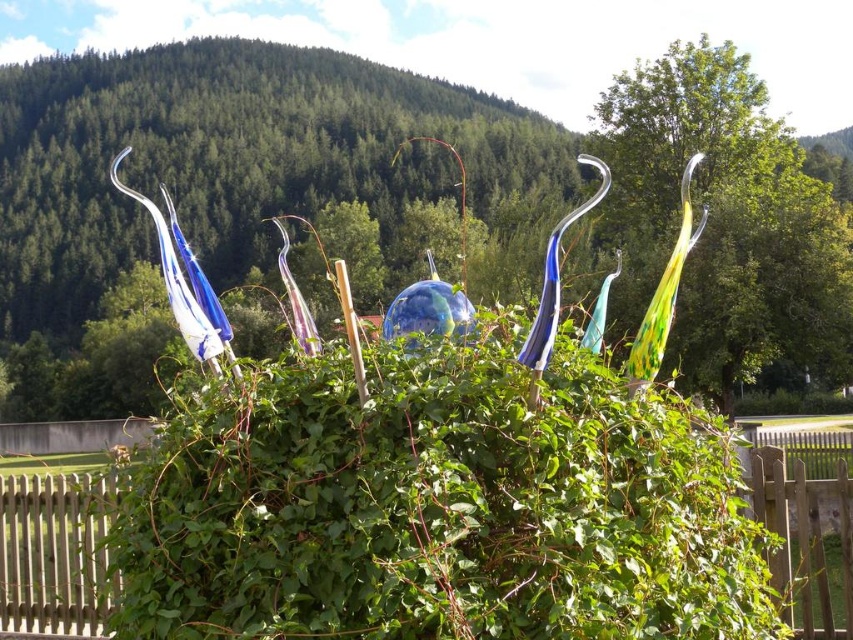
Is green leafy bush at center to the left of wooden fence at lower right from the viewer's perspective?

Indeed, green leafy bush at center is positioned on the left side of wooden fence at lower right.

Where is `green leafy bush at center`? green leafy bush at center is located at coordinates (437, 508).

Locate an element on the screen. The height and width of the screenshot is (640, 853). green leafy bush at center is located at coordinates (437, 508).

Who is taller, green leafy bush at center or white wooden fence at lower left?

white wooden fence at lower left is taller.

How distant is green leafy bush at center from white wooden fence at lower left?

green leafy bush at center and white wooden fence at lower left are 1.64 meters apart.

Is point (682, 522) closer to camera compared to point (39, 518)?

Yes, point (682, 522) is closer to viewer.

Find the location of a particular element. Image resolution: width=853 pixels, height=640 pixels. green leafy bush at center is located at coordinates (437, 508).

Which is more to the left, white wooden fence at lower left or wooden fence at lower right?

From the viewer's perspective, white wooden fence at lower left appears more on the left side.

Is white wooden fence at lower left to the right of wooden fence at lower right from the viewer's perspective?

No, white wooden fence at lower left is not to the right of wooden fence at lower right.

Who is more forward, [93,628] or [746,509]?

Point [746,509] is more forward.

Locate an element on the screen. white wooden fence at lower left is located at coordinates (56, 554).